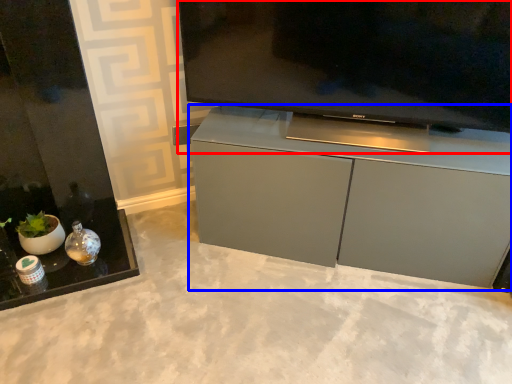
Question: Which point is further to the camera, television (highlighted by a red box) or cabinetry (highlighted by a blue box)?

Choices:
 (A) television
 (B) cabinetry

Answer: (B)